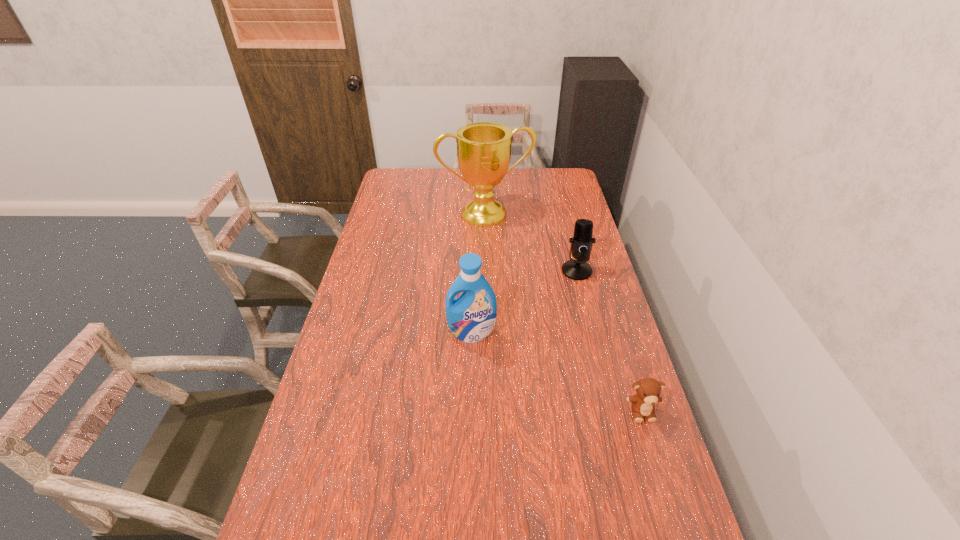
In order to click on the second tallest object in this screenshot , I will do `click(471, 317)`.

Where is `detergent`? detergent is located at coordinates (471, 317).

The width and height of the screenshot is (960, 540). I want to click on teddy bear, so click(x=648, y=390).

What are the coordinates of `the shortest object` in the screenshot? It's located at (648, 390).

Locate an element on the screen. the tallest object is located at coordinates (483, 149).

The image size is (960, 540). I want to click on award, so click(483, 149).

I want to click on the third nearest object, so click(581, 243).

This screenshot has height=540, width=960. Find the location of `microphone`. microphone is located at coordinates (581, 243).

The height and width of the screenshot is (540, 960). What are the coordinates of `vacant space located on the front-facing side of the third shortest object` in the screenshot? It's located at (471, 366).

Identify the location of free location located on the face of the teddy bear. tap(672, 510).